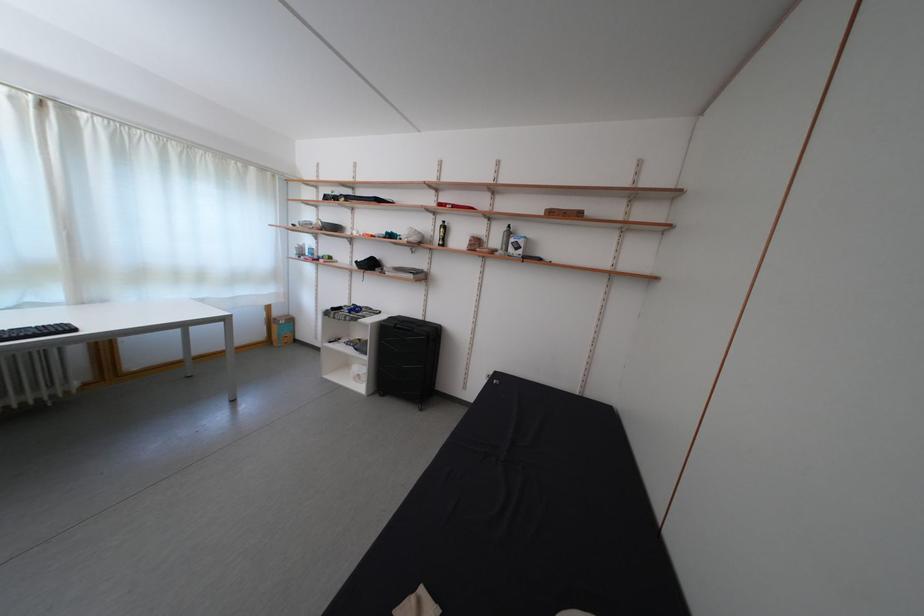
Find where to lift the white bowl. Please return your answer as a coordinate pair (x, y).

(331, 225)